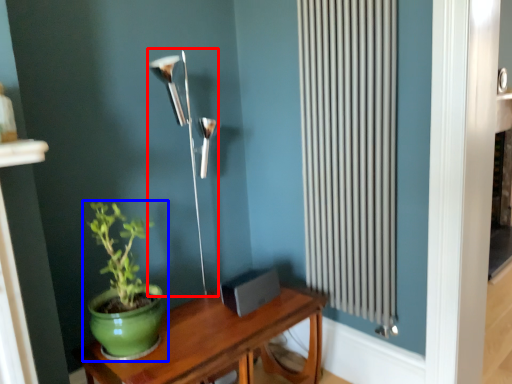
Question: Which object appears closest to the camera in this image, lamp (highlighted by a red box) or houseplant (highlighted by a blue box)?

Choices:
 (A) lamp
 (B) houseplant

Answer: (B)